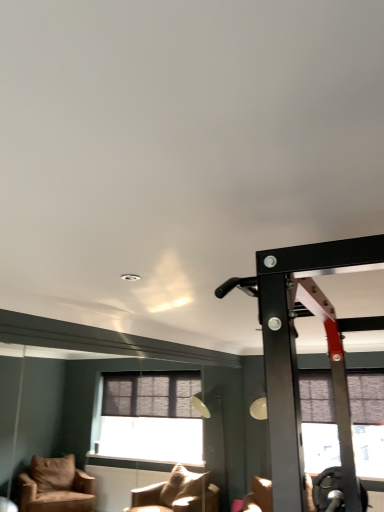
What do you see at coordinates (325, 490) in the screenshot? Image resolution: width=384 pixels, height=512 pixels. I see `brown leather couch at lower right` at bounding box center [325, 490].

I want to click on brown leather couch at lower right, so click(325, 490).

In order to face brown leather couch at lower right, should I rotate leftwards or rightwards?

You should look right and rotate roughly 12.703 degrees.

Image resolution: width=384 pixels, height=512 pixels. Identify the location of brown leather couch at lower right. (325, 490).